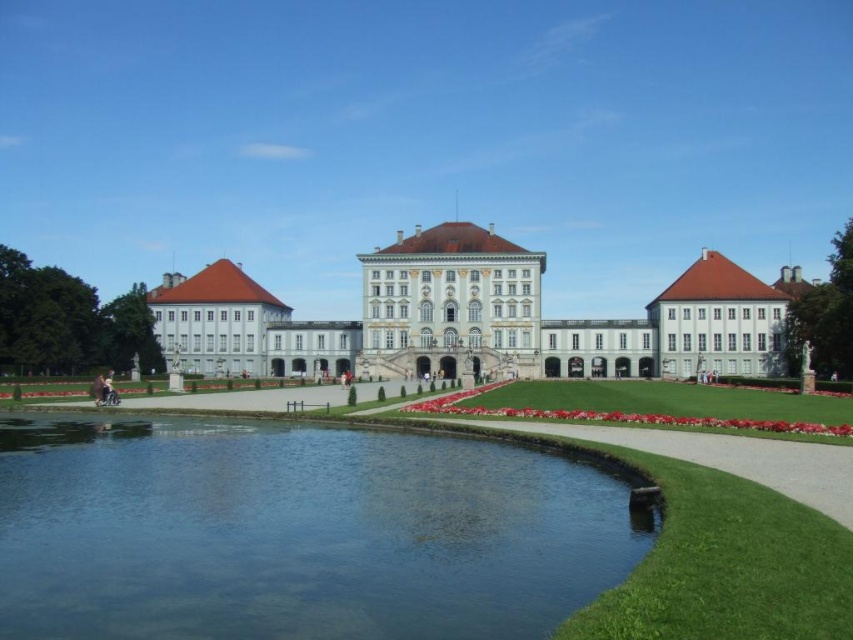
Question: Is clear water at bottom center closer to the viewer compared to white stone palace at center?

Choices:
 (A) no
 (B) yes

Answer: (B)

Question: Is clear water at bottom center to the right of white stone palace at center from the viewer's perspective?

Choices:
 (A) no
 (B) yes

Answer: (A)

Question: Does clear water at bottom center have a smaller size compared to white stone palace at center?

Choices:
 (A) yes
 (B) no

Answer: (A)

Question: Among these points, which one is nearest to the camera?

Choices:
 (A) 753,358
 (B) 566,570

Answer: (B)